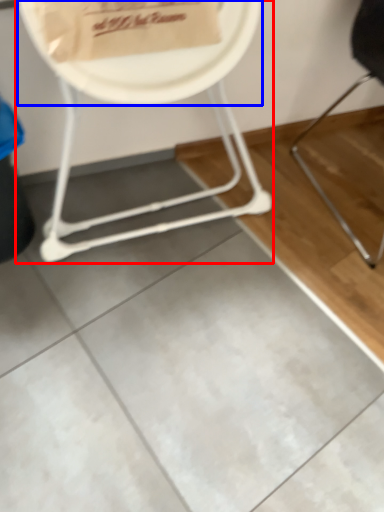
Question: Which object is closer to the camera taking this photo, chair (highlighted by a red box) or paper plate (highlighted by a blue box)?

Choices:
 (A) chair
 (B) paper plate

Answer: (A)